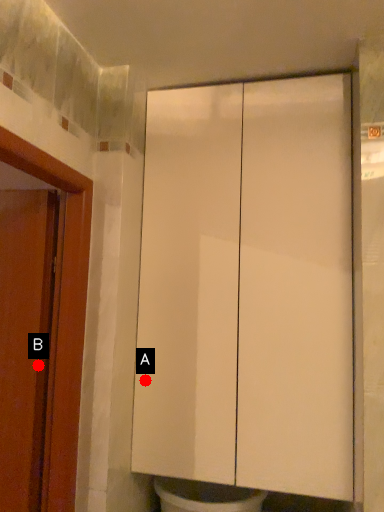
Question: Two points are circled on the image, labeled by A and B beside each circle. Which point appears closest to the camera in this image?

Choices:
 (A) A is closer
 (B) B is closer

Answer: (B)